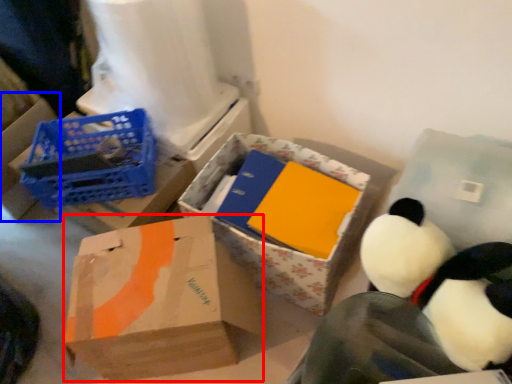
Question: Which object is closer to the camera taking this photo, box (highlighted by a red box) or box (highlighted by a blue box)?

Choices:
 (A) box
 (B) box

Answer: (A)